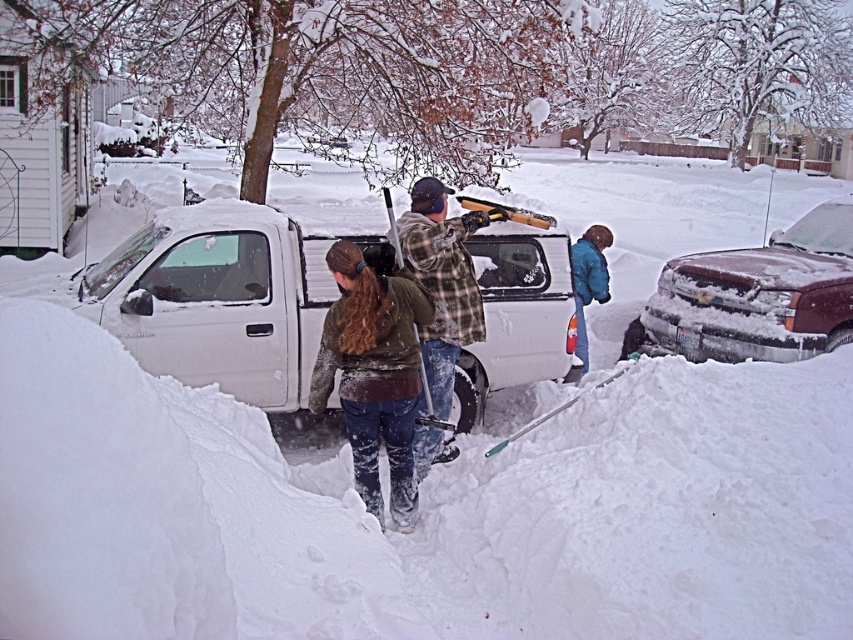
Is white matte truck at center thinner than flannel plaid shirt at center?

Incorrect, white matte truck at center's width is not less than flannel plaid shirt at center's.

Can you confirm if white matte truck at center is taller than flannel plaid shirt at center?

Incorrect, white matte truck at center's height is not larger of flannel plaid shirt at center's.

Locate an element on the screen. This screenshot has width=853, height=640. white matte truck at center is located at coordinates (229, 292).

What are the coordinates of `white matte truck at center` in the screenshot? It's located at (229, 292).

Does shiny brown car at lower right appear on the right side of green fuzzy sweater at center?

Yes, shiny brown car at lower right is to the right of green fuzzy sweater at center.

Is shiny brown car at lower right wider than green fuzzy sweater at center?

Yes, shiny brown car at lower right is wider than green fuzzy sweater at center.

This screenshot has height=640, width=853. I want to click on shiny brown car at lower right, so click(759, 294).

You are a GUI agent. You are given a task and a screenshot of the screen. Output one action in this format:
    pyautogui.click(x=<x>, y=<y>)
    Task: Click on the shiny brown car at lower right
    The image size is (853, 640).
    Given the screenshot: What is the action you would take?
    pyautogui.click(x=759, y=294)

Based on the photo, is green fuzzy sweater at center shorter than flannel plaid shirt at center?

Yes.

Is green fuzzy sweater at center thinner than flannel plaid shirt at center?

Yes, green fuzzy sweater at center is thinner than flannel plaid shirt at center.

Image resolution: width=853 pixels, height=640 pixels. I want to click on green fuzzy sweater at center, so (x=373, y=374).